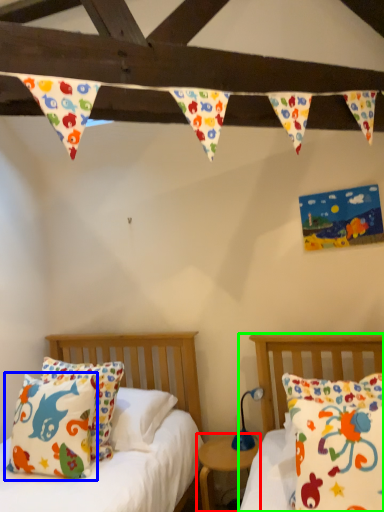
Question: Which object is positioned closest to nightstand (highlighted by a red box)? Select from pillow (highlighted by a blue box) and bed (highlighted by a green box).

Choices:
 (A) pillow
 (B) bed

Answer: (B)